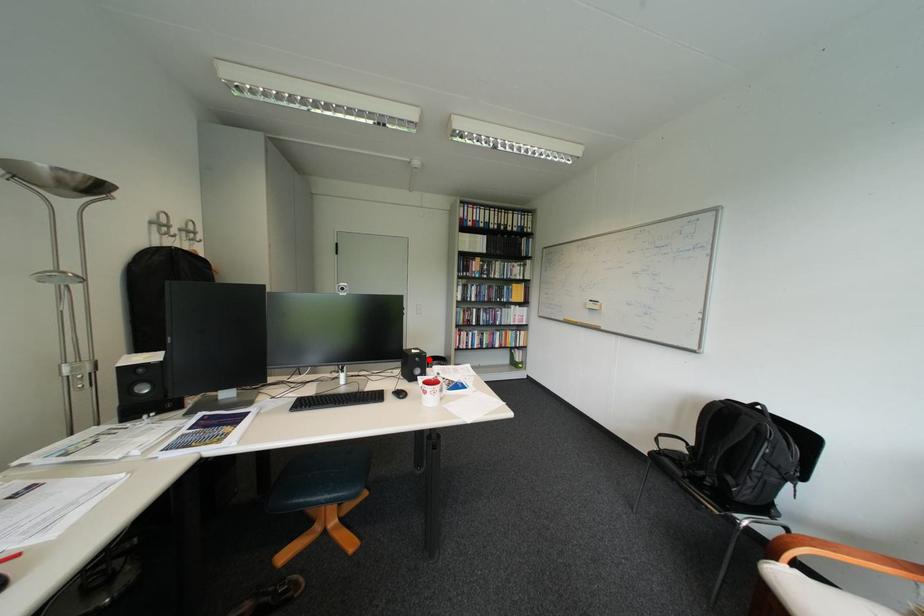
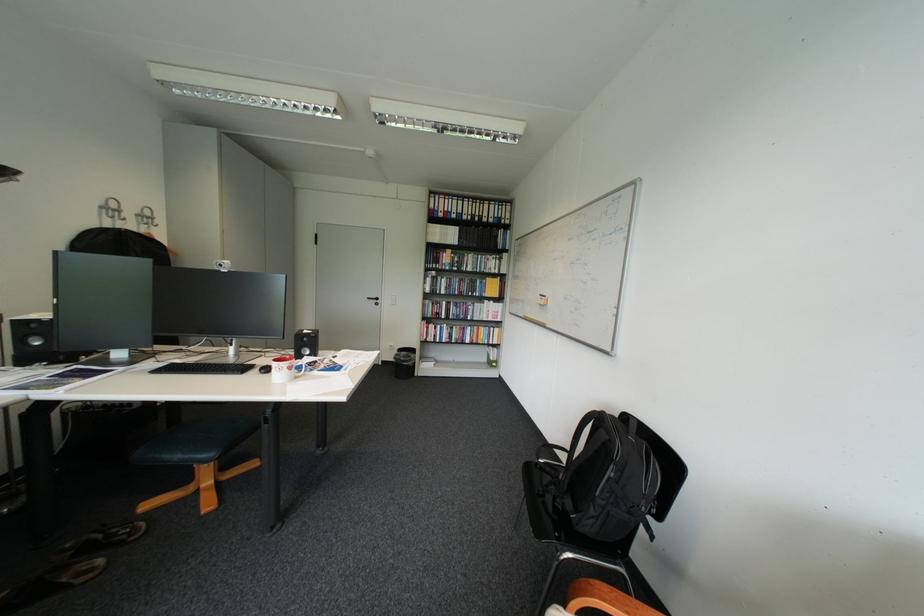
Question: I am providing you with two images of the same scene from different viewpoints. In image1, a red point is highlighted. Considering the same 3D point in image2, which of the following is correct?

Choices:
 (A) It is closer
 (B) It is farther

Answer: (B)